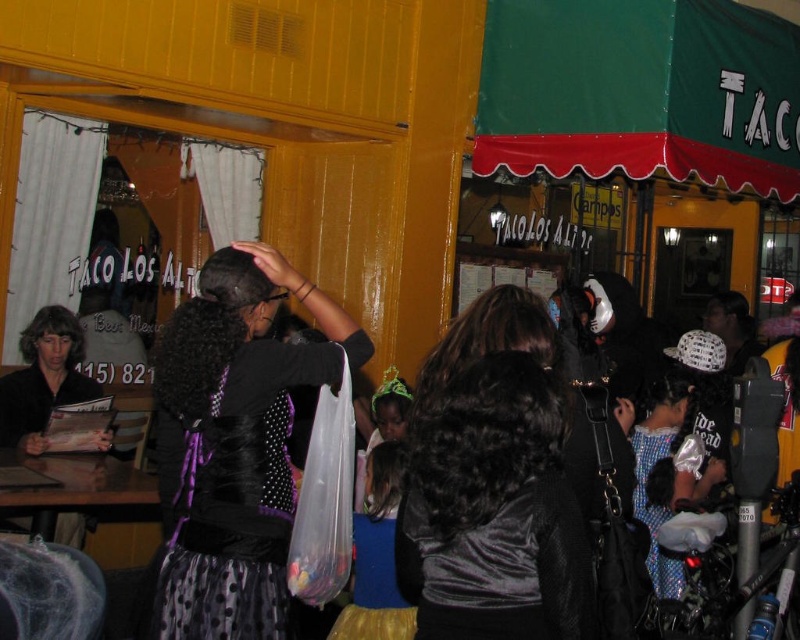
Between black satin dress at center and velvet black shirt at center, which one is positioned higher?

black satin dress at center is higher up.

How far apart are black satin dress at center and velvet black shirt at center?

A distance of 85.72 centimeters exists between black satin dress at center and velvet black shirt at center.

Find the location of a particular element. This screenshot has width=800, height=640. black satin dress at center is located at coordinates (234, 442).